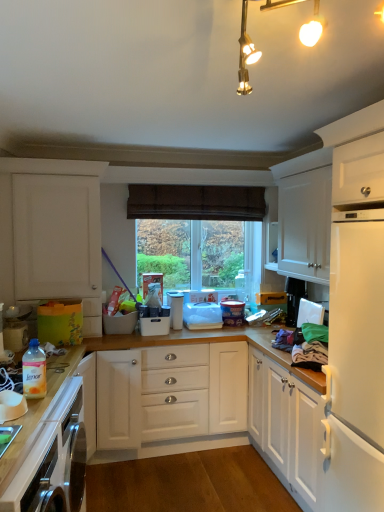
This screenshot has height=512, width=384. I want to click on transparent plastic window screen at center, so click(x=190, y=252).

Identify the location of white plastic container at center, positioned as the 3th appliance in left-to-right order. Image resolution: width=384 pixels, height=512 pixels. (175, 309).

How much space does white plastic container at center, the second appliance in the back-to-front sequence, occupy vertically?

white plastic container at center, the second appliance in the back-to-front sequence, is 11.62 inches in height.

How much space does translucent plastic fabric softener at lower left, which is the 1th appliance in front-to-back order, occupy horizontally?

translucent plastic fabric softener at lower left, which is the 1th appliance in front-to-back order, is 3.08 inches wide.

The width and height of the screenshot is (384, 512). What are the coordinates of `transparent plastic window screen at center` in the screenshot? It's located at (190, 252).

Measure the distance between white plastic container at center, positioned as the 3th appliance in left-to-right order, and translucent plastic fabric softener at lower left, placed as the fourth appliance when sorted from back to front.

4.60 feet.

Is white plastic container at center, the second appliance in the back-to-front sequence, bigger than translucent plastic fabric softener at lower left, which is the 1th appliance in front-to-back order?

Yes.

Does white plastic container at center, the second appliance in the back-to-front sequence, have a lesser width compared to translucent plastic fabric softener at lower left, which is the 1th appliance in left-to-right order?

No, white plastic container at center, the second appliance in the back-to-front sequence, is not thinner than translucent plastic fabric softener at lower left, which is the 1th appliance in left-to-right order.

Consider the image. Which is less distant, (171, 321) or (27, 396)?

Point (171, 321) is positioned farther from the camera compared to point (27, 396).

Is translucent plastic fabric softener at lower left, which is the 1th appliance in left-to-right order, outside of wooden countertop at lower left?

Absolutely, translucent plastic fabric softener at lower left, which is the 1th appliance in left-to-right order, is external to wooden countertop at lower left.

Does point (24, 388) lie in front of point (80, 414)?

Yes, point (24, 388) is closer to viewer.

In the image, is translucent plastic fabric softener at lower left, placed as the fourth appliance when sorted from back to front, on the left side or the right side of wooden countertop at lower left?

From the image, it's evident that translucent plastic fabric softener at lower left, placed as the fourth appliance when sorted from back to front, is to the right of wooden countertop at lower left.

Is the surface of white plastic container at center, which appears as the 2th appliance when viewed from the front, in direct contact with white plastic container at center, which is counted as the 1th appliance, starting from the back?

No, white plastic container at center, which appears as the 2th appliance when viewed from the front, is not beside white plastic container at center, which is counted as the 1th appliance, starting from the back.

Can we say white plastic container at center, which appears as the 2th appliance when viewed from the front, lies outside white plastic container at center, which ranks as the first appliance in right-to-left order?

Yes.

Can you tell me how much white plastic container at center, the 3th appliance positioned from the back, and white plastic container at center, which ranks as the first appliance in right-to-left order, differ in facing direction?

They differ by 1.81 degrees in their facing directions.

Can you confirm if wooden countertop at lower left is shorter than white matte cabinet at left, marked as the 1th cabinetry in a left-to-right arrangement?

Correct, wooden countertop at lower left is not as tall as white matte cabinet at left, marked as the 1th cabinetry in a left-to-right arrangement.

Looking at this image, can you see wooden countertop at lower left touching white matte cabinet at left, marked as the 1th cabinetry in a left-to-right arrangement?

wooden countertop at lower left is not next to white matte cabinet at left, marked as the 1th cabinetry in a left-to-right arrangement, and they're not touching.

From a real-world perspective, relative to white matte cabinet at left, which ranks as the second cabinetry in right-to-left order, is wooden countertop at lower left vertically above or below?

In terms of real-world spatial position, wooden countertop at lower left is below white matte cabinet at left, which ranks as the second cabinetry in right-to-left order.

How different are the orientations of wooden countertop at lower left and white matte cabinet at left, which ranks as the second cabinetry in right-to-left order, in degrees?

wooden countertop at lower left and white matte cabinet at left, which ranks as the second cabinetry in right-to-left order, are facing 84 degrees away from each other.

From the image's perspective, is white matte cabinet at upper right, which is counted as the second cabinetry, starting from the left, positioned above or below white plastic container at center, the second appliance in the back-to-front sequence?

white matte cabinet at upper right, which is counted as the second cabinetry, starting from the left, is above white plastic container at center, the second appliance in the back-to-front sequence.

Is white matte cabinet at upper right, the 1th cabinetry in the right-to-left sequence, positioned far away from white plastic container at center, the second appliance in the back-to-front sequence?

Yes, white matte cabinet at upper right, the 1th cabinetry in the right-to-left sequence, is far from white plastic container at center, the second appliance in the back-to-front sequence.

Considering the positions of objects white matte cabinet at upper right, the 1th cabinetry in the right-to-left sequence, and white plastic container at center, the second appliance in the back-to-front sequence, in the image provided, who is more to the right, white matte cabinet at upper right, the 1th cabinetry in the right-to-left sequence, or white plastic container at center, the second appliance in the back-to-front sequence,?

Positioned to the right is white matte cabinet at upper right, the 1th cabinetry in the right-to-left sequence.

Measure the distance between white matte cabinet at upper right, which is counted as the second cabinetry, starting from the left, and white plastic container at center, which is the third appliance from front to back.

They are 3.89 feet apart.

Considering the positions of objects transparent plastic window screen at center and white matte cabinet at left, which ranks as the second cabinetry in right-to-left order, in the image provided, who is more to the right, transparent plastic window screen at center or white matte cabinet at left, which ranks as the second cabinetry in right-to-left order,?

transparent plastic window screen at center is more to the right.

Does point (209, 271) come behind point (91, 162)?

Yes, point (209, 271) is farther from viewer.

Considering the sizes of transparent plastic window screen at center and white matte cabinet at left, marked as the 1th cabinetry in a left-to-right arrangement, in the image, is transparent plastic window screen at center bigger or smaller than white matte cabinet at left, marked as the 1th cabinetry in a left-to-right arrangement,?

transparent plastic window screen at center is smaller than white matte cabinet at left, marked as the 1th cabinetry in a left-to-right arrangement.

Is transparent plastic window screen at center facing away from white matte cabinet at left, which ranks as the second cabinetry in right-to-left order?

transparent plastic window screen at center does not have its back to white matte cabinet at left, which ranks as the second cabinetry in right-to-left order.

Which of these two, white plastic container at center, the second appliance in the back-to-front sequence, or white matte cabinet at left, marked as the 1th cabinetry in a left-to-right arrangement, is bigger?

With larger size is white matte cabinet at left, marked as the 1th cabinetry in a left-to-right arrangement.

Which point is more distant from viewer, (181, 310) or (87, 280)?

The point (181, 310) is farther.

From the image's perspective, does white plastic container at center, which is the third appliance from front to back, appear lower than white matte cabinet at left, marked as the 1th cabinetry in a left-to-right arrangement?

Yes, from the image's perspective, white plastic container at center, which is the third appliance from front to back, is below white matte cabinet at left, marked as the 1th cabinetry in a left-to-right arrangement.

In terms of height, does white plastic container at center, the second appliance in the back-to-front sequence, look taller or shorter compared to white matte cabinet at left, which ranks as the second cabinetry in right-to-left order?

white plastic container at center, the second appliance in the back-to-front sequence, is shorter than white matte cabinet at left, which ranks as the second cabinetry in right-to-left order.

Starting from the translucent plastic fabric softener at lower left, acting as the 4th appliance starting from the right, which appliance is the 2nd one to the right? Please provide its 2D coordinates.

[(175, 309)]

From the wooden countertop at lower left, count 1st appliances backward and point to it. Please provide its 2D coordinates.

[(34, 371)]

When comparing their distances from white matte cabinet at upper right, the 1th cabinetry in the right-to-left sequence, does translucent plastic fabric softener at lower left, which is the 1th appliance in front-to-back order, or white matte cabinet at left, marked as the 1th cabinetry in a left-to-right arrangement, seem further?

Based on the image, translucent plastic fabric softener at lower left, which is the 1th appliance in front-to-back order, appears to be further to white matte cabinet at upper right, the 1th cabinetry in the right-to-left sequence.

When comparing their distances from wooden countertop at lower left, does translucent plastic fabric softener at lower left, placed as the fourth appliance when sorted from back to front, or transparent plastic window screen at center seem closer?

translucent plastic fabric softener at lower left, placed as the fourth appliance when sorted from back to front, is positioned closer to the anchor wooden countertop at lower left.

Which object lies nearer to the anchor point white plastic container at center, which is counted as the third appliance, starting from the right, wooden countertop at lower left or translucent plastic fabric softener at lower left, placed as the fourth appliance when sorted from back to front?

wooden countertop at lower left lies closer to white plastic container at center, which is counted as the third appliance, starting from the right, than the other object.

Looking at the image, which one is located further to white matte cabinet at left, which ranks as the second cabinetry in right-to-left order, white plastic container at center, which appears as the 2th appliance when viewed from the front, or white plastic container at center, the second appliance in the back-to-front sequence?

Based on the image, white plastic container at center, the second appliance in the back-to-front sequence, appears to be further to white matte cabinet at left, which ranks as the second cabinetry in right-to-left order.

Considering their positions, is white matte cabinet at left, which ranks as the second cabinetry in right-to-left order, positioned further to white plastic container at center, placed as the second appliance when sorted from right to left, than translucent plastic fabric softener at lower left, which is the 1th appliance in left-to-right order?

translucent plastic fabric softener at lower left, which is the 1th appliance in left-to-right order, is positioned further to the anchor white plastic container at center, placed as the second appliance when sorted from right to left.

Considering their positions, is white matte cabinet at left, marked as the 1th cabinetry in a left-to-right arrangement, positioned closer to transparent plastic window screen at center than white plastic container at center, which appears as the 2th appliance when viewed from the left?

The object closer to transparent plastic window screen at center is white plastic container at center, which appears as the 2th appliance when viewed from the left.

Looking at the image, which one is located further to white matte cabinet at left, which ranks as the second cabinetry in right-to-left order, white plastic container at center, positioned as the 3th appliance in left-to-right order, or wooden countertop at lower left?

white plastic container at center, positioned as the 3th appliance in left-to-right order.

Based on their spatial positions, is white plastic container at center, the 3th appliance positioned from the back, or translucent plastic fabric softener at lower left, placed as the fourth appliance when sorted from back to front, further from white matte cabinet at left, which ranks as the second cabinetry in right-to-left order?

translucent plastic fabric softener at lower left, placed as the fourth appliance when sorted from back to front.

Locate an element on the screen. This screenshot has width=384, height=512. window screen situated between white plastic container at center, placed as the second appliance when sorted from right to left, and white plastic container at center, which is counted as the 1th appliance, starting from the back, from left to right is located at coordinates (190, 252).

Where is `window screen located between white plastic container at center, which is counted as the third appliance, starting from the right, and white matte cabinet at upper right, the 1th cabinetry in the right-to-left sequence, in the left-right direction`? Image resolution: width=384 pixels, height=512 pixels. window screen located between white plastic container at center, which is counted as the third appliance, starting from the right, and white matte cabinet at upper right, the 1th cabinetry in the right-to-left sequence, in the left-right direction is located at coordinates (190, 252).

The image size is (384, 512). What are the coordinates of `window screen between white plastic container at center, the second appliance in the back-to-front sequence, and white matte cabinet at upper right, which is counted as the second cabinetry, starting from the left, from left to right` in the screenshot? It's located at (190, 252).

Locate an element on the screen. This screenshot has height=512, width=384. countertop between white matte cabinet at left, marked as the 1th cabinetry in a left-to-right arrangement, and white matte cabinet at upper right, which is counted as the second cabinetry, starting from the left is located at coordinates (43, 438).